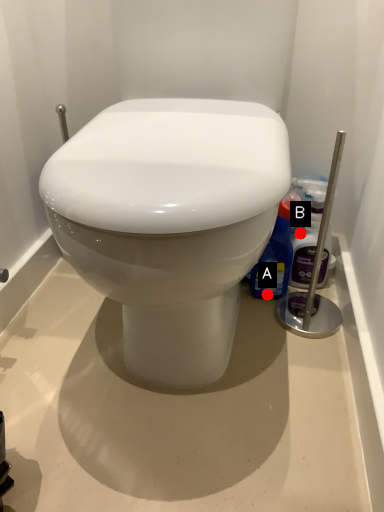
Question: Two points are circled on the image, labeled by A and B beside each circle. Which of the following is the closest to the observer?

Choices:
 (A) A is closer
 (B) B is closer

Answer: (B)